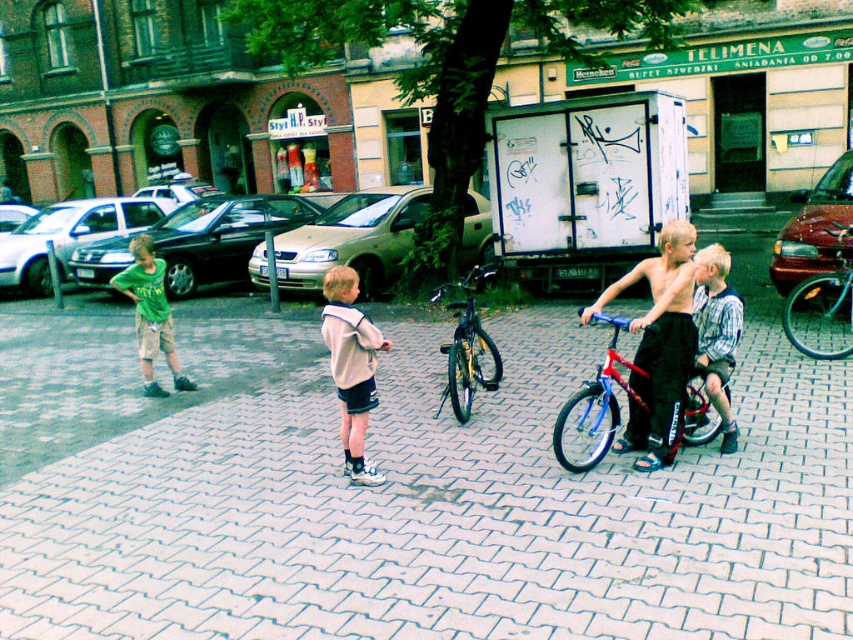
How far apart are checkered fabric shirt at center and blue metallic bicycle at center?

checkered fabric shirt at center is 3.01 meters away from blue metallic bicycle at center.

Can you confirm if checkered fabric shirt at center is bigger than blue metallic bicycle at center?

Incorrect, checkered fabric shirt at center is not larger than blue metallic bicycle at center.

Describe the element at coordinates (717, 332) in the screenshot. I see `checkered fabric shirt at center` at that location.

This screenshot has height=640, width=853. I want to click on checkered fabric shirt at center, so click(x=717, y=332).

At what (x,y) coordinates should I click in order to perform the action: click on shiny black shorts at center. Please return your answer as a coordinate pair (x, y). Looking at the image, I should click on (659, 346).

Can you confirm if shiny black shorts at center is bigger than green cotton shirt at left?

Yes.

Is point (669, 337) farther from viewer compared to point (148, 394)?

No, (669, 337) is in front of (148, 394).

Find the location of a particular element. shiny black shorts at center is located at coordinates (659, 346).

Can you confirm if blue metallic bicycle at center is positioned below shiny black bicycle at center?

No, blue metallic bicycle at center is not below shiny black bicycle at center.

In the scene shown: Is blue metallic bicycle at center to the right of shiny black bicycle at center from the viewer's perspective?

Correct, you'll find blue metallic bicycle at center to the right of shiny black bicycle at center.

You are a GUI agent. You are given a task and a screenshot of the screen. Output one action in this format:
    pyautogui.click(x=<x>, y=<y>)
    Task: Click on the blue metallic bicycle at center
    Image resolution: width=853 pixels, height=640 pixels.
    Given the screenshot: What is the action you would take?
    pyautogui.click(x=822, y=307)